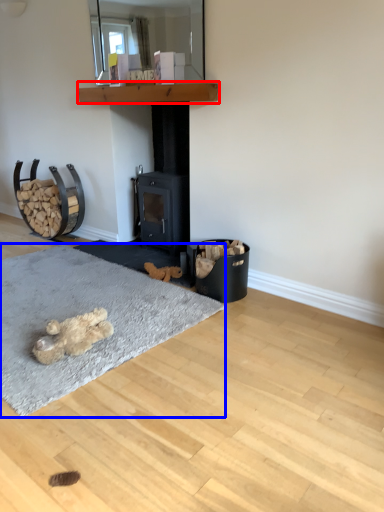
Question: Which object appears farthest to the camera in this image, shelf (highlighted by a red box) or mat (highlighted by a blue box)?

Choices:
 (A) shelf
 (B) mat

Answer: (A)